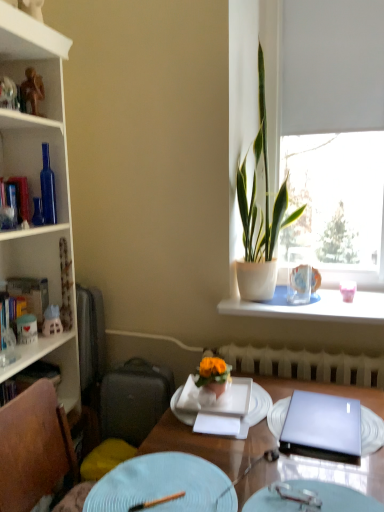
Locate an element on the screen. The image size is (384, 512). free point behind light blue ceramic plate at center, which is the 2th plate from back to front is located at coordinates (210, 430).